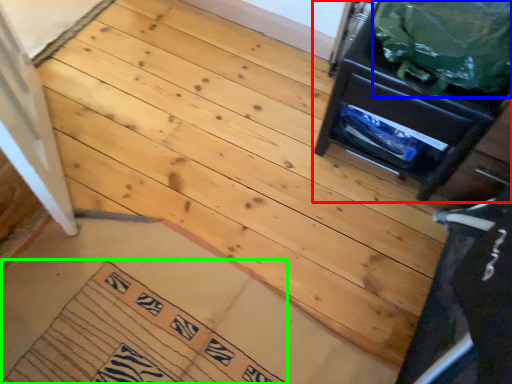
Question: Estimate the real-world distances between objects in this image. Which object is farther from furniture (highlighted by a red box), garbage (highlighted by a blue box) or doormat (highlighted by a green box)?

Choices:
 (A) garbage
 (B) doormat

Answer: (B)